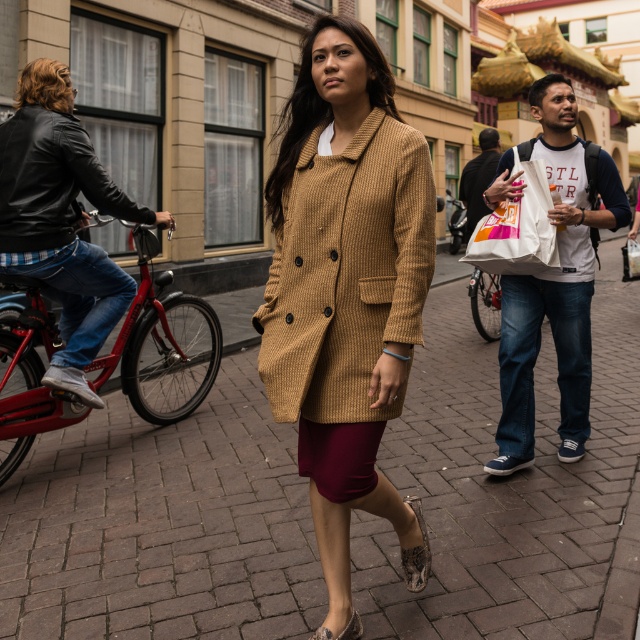
You are a pedestrian standing on the street and you see the leather textured sandal at lower center and the leather sandal at lower center. Which one is positioned more to the right side?

The leather textured sandal at lower center is positioned more to the right side than the leather sandal at lower center.